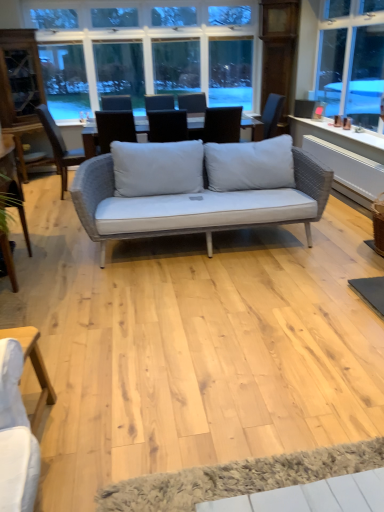
Image resolution: width=384 pixels, height=512 pixels. What are the coordinates of `free space above white textured yoga mat at lower center (from a real-world perspective)` in the screenshot? It's located at (244, 477).